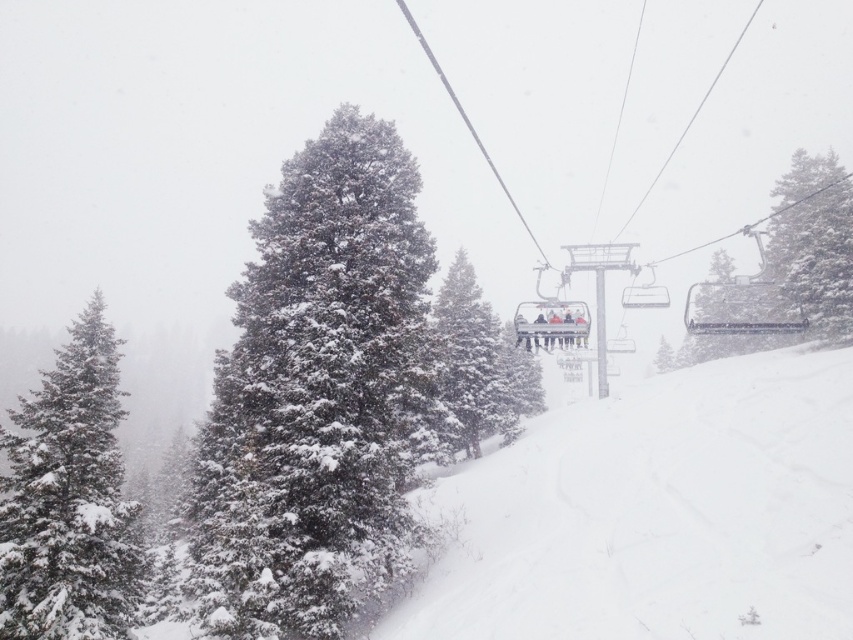
In the scene shown: Who is higher up, snow-covered evergreen at center or snow-covered pine at center?

Positioned higher is snow-covered pine at center.

Describe the element at coordinates (317, 394) in the screenshot. This screenshot has width=853, height=640. I see `snow-covered evergreen at center` at that location.

Does point (413, 307) come in front of point (456, 268)?

Yes.

Find the location of a particular element. snow-covered evergreen at center is located at coordinates (317, 394).

Between snow-covered evergreen at center and green textured pine tree at upper right, which one has less height?

green textured pine tree at upper right

Is snow-covered evergreen at center wider than green textured pine tree at upper right?

No.

Does point (309, 371) lie in front of point (843, 234)?

Yes, it is.

What are the coordinates of `snow-covered evergreen at center` in the screenshot? It's located at (317, 394).

Does snow-covered evergreen at left have a greater width compared to snow-covered pine at center?

Correct, the width of snow-covered evergreen at left exceeds that of snow-covered pine at center.

Is snow-covered evergreen at left below snow-covered pine at center?

Indeed, snow-covered evergreen at left is positioned under snow-covered pine at center.

Which is in front, point (62, 474) or point (436, 385)?

Point (62, 474) is more forward.

Locate an element on the screen. snow-covered evergreen at left is located at coordinates (68, 499).